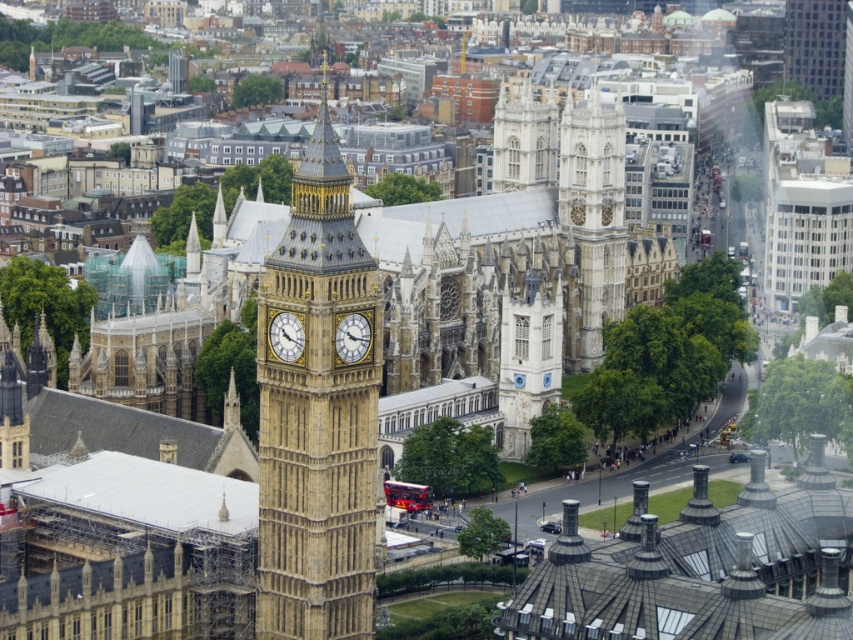
Is gold metallic clock at center taller than gold textured clock at center?

Yes.

At what (x,y) coordinates should I click in order to perform the action: click on gold metallic clock at center. Please return your answer as a coordinate pair (x, y). Looking at the image, I should click on (285, 337).

Locate an element on the screen. The height and width of the screenshot is (640, 853). gold metallic clock at center is located at coordinates (285, 337).

Who is taller, white stone clock tower at center-right or gold metallic clock at center?

With more height is white stone clock tower at center-right.

From the picture: Who is lower down, white stone clock tower at center-right or gold metallic clock at center?

gold metallic clock at center

Locate an element on the screen. white stone clock tower at center-right is located at coordinates (593, 212).

Describe the element at coordinates (318, 416) in the screenshot. The width and height of the screenshot is (853, 640). I see `golden stone clock tower at center` at that location.

How distant is golden stone clock tower at center from gold metallic clock at center?

golden stone clock tower at center is 9.97 meters from gold metallic clock at center.

Where is `golden stone clock tower at center`? golden stone clock tower at center is located at coordinates [x=318, y=416].